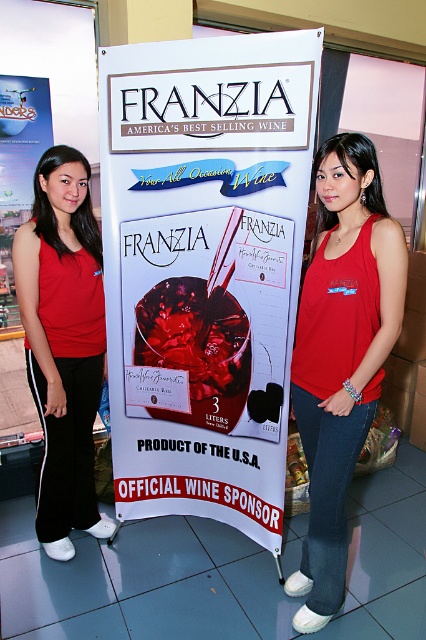
You are a photographer trying to capture a clear photo of both the white paper poster at center and the matte red tank top at center. Given that your camera can only focus on objects within a 12 inch range, will you be able to capture both items in focus without adjusting your camera settings?

The white paper poster at center and the matte red tank top at center are 14.32 inches apart, which exceeds the camera focus range of 12 inches. Therefore, you cannot capture both items in focus without adjusting your camera settings.

You are a photographer taking a picture of the scene. You notice the white paper poster at center and the red tank top at center. Which object should you focus on first if you want to capture the taller one in the frame?

The white paper poster at center is taller than the red tank top at center, so you should focus on the white paper poster at center first to capture the taller object in the frame.